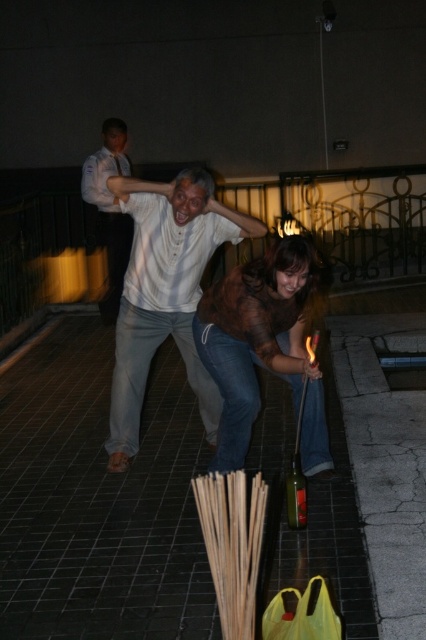
You are a fashion designer observing the scene. You notice the white matte shirt at center and the matte brown sweater at center. Which clothing item appears to be bigger in size?

The white matte shirt at center has a larger size compared to the matte brown sweater at center.

Looking at the scene, where is the matte brown sweater at center in relation to the white shirt at upper center?

The matte brown sweater at center is located to the right of the white shirt at upper center.

You are a photographer trying to capture a closeup shot of the matte brown sweater at center and the white shirt at upper center. Given that your camera can only focus on objects wider than 30 cm, will both items be in focus?

The matte brown sweater at center has a larger width than the white shirt at upper center. Since the camera focuses on objects wider than 30 cm, the matte brown sweater at center will be in focus, but the white shirt at upper center may not be if its width is under 30 cm.